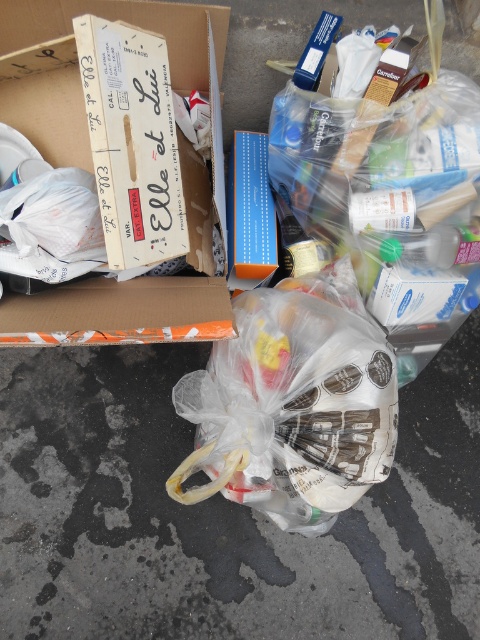
You are a delivery person who needs to deliver a fragile item. You see a clear plastic bag at center and a white cardboard box at upper left. Which item is closer to the center of the scene?

The clear plastic bag at center is to the right of the white cardboard box at upper left, so the clear plastic bag at center is closer to the center of the scene.

You are a delivery person who needs to retrieve the white cardboard box at upper left from behind the clear plastic bag at center. Is the box accessible without moving the bag?

The white cardboard box at upper left is behind the clear plastic bag at center, so you cannot access it without moving the bag.

You are standing at the origin point in the scene. Which of the two points, point (350, 321) or point (184, 200), is closer to you?

Point (184, 200) is closer to you because it is behind point (350, 321), meaning the latter is farther away.